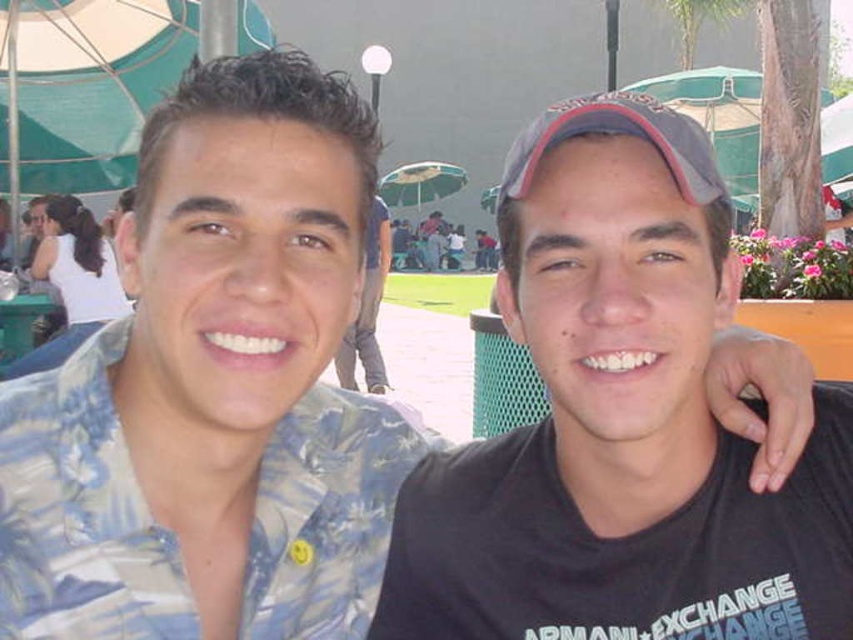
You are standing in the park and see the two people in the image. There is a point marked at coordinates (619, 422). Which object does this point correspond to?

The point at coordinates (619, 422) is on the black matte cap at center.